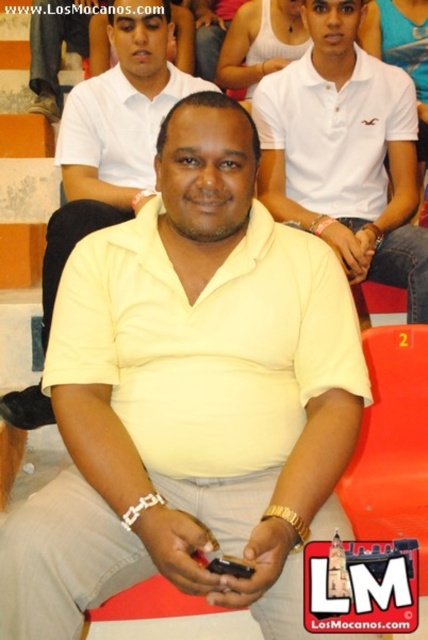
You are designing a spatial layout for a stage performance. The stage has a limited width of 1.2 meters between two props. You need to place both the yellow matte shirt at center and the matte black shoe at upper left on the stage. Considering their widths, will both fit side by side without overlapping?

The yellow matte shirt at center is wider than the matte black shoe at upper left. Since the total width of both objects combined would exceed the 1.2 meters available, they cannot fit side by side without overlapping on the stage.

You are attending a sports event and notice two items in the image. One is the white matte polo shirt at center and the other is the matte black shoe at upper left. Which item is located to the right of the other?

The white matte polo shirt at center is positioned on the right side of matte black shoe at upper left.